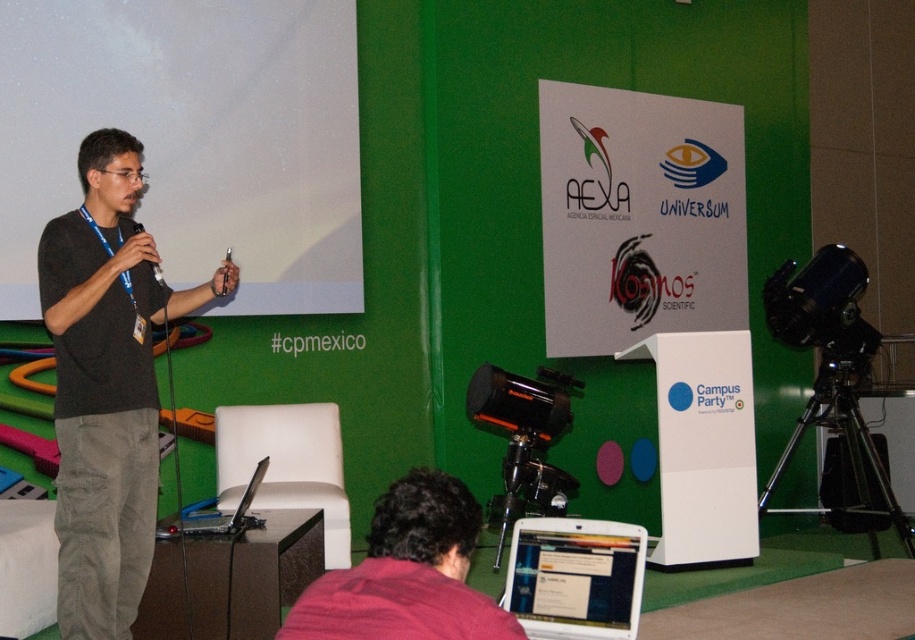
You are an attendee at the presentation. You notice the white matte projection screen at upper left and the dark gray sweater at left. Which object is positioned to the left of the other?

The white matte projection screen at upper left is to the left of the dark gray sweater at left.

From the picture: You are an attendee at this presentation. You need to borrow an item that can be easily carried without a bag. Which item between the silver metallic laptop at lower center and the black plastic microphone at upper left would you choose and why?

The black plastic microphone at upper left is smaller in size than the silver metallic laptop at lower center, so it would be easier to carry without a bag.